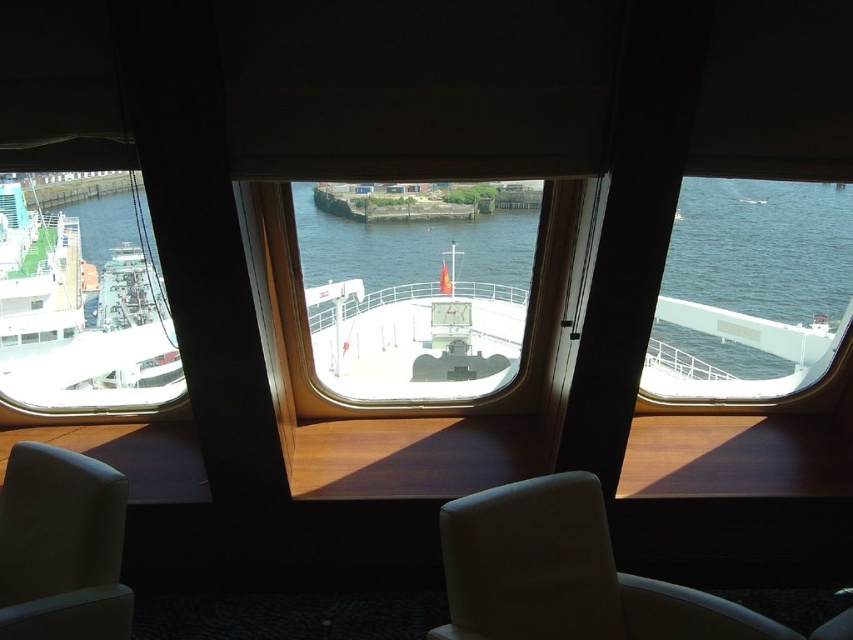
Is white leather armchair at center to the left of matte gray armchair at lower left from the viewer's perspective?

No, white leather armchair at center is not to the left of matte gray armchair at lower left.

Looking at this image, can you confirm if white leather armchair at center is thinner than matte gray armchair at lower left?

No, white leather armchair at center is not thinner than matte gray armchair at lower left.

At what (x,y) coordinates should I click in order to perform the action: click on white leather armchair at center. Please return your answer as a coordinate pair (x, y). This screenshot has width=853, height=640. Looking at the image, I should click on (572, 576).

Between point (776, 305) and point (65, 294), which one is positioned in front?

Point (776, 305) is in front.

Between point (757, 195) and point (135, 385), which one is positioned in front?

Point (757, 195) is more forward.

Image resolution: width=853 pixels, height=640 pixels. I want to click on dark blue water at right, so click(x=756, y=275).

Who is shorter, dark blue water at right or matte gray armchair at lower left?

matte gray armchair at lower left

Who is positioned more to the right, dark blue water at right or matte gray armchair at lower left?

Positioned to the right is dark blue water at right.

Where is `dark blue water at right`? dark blue water at right is located at coordinates (756, 275).

Identify the location of dark blue water at right. The image size is (853, 640). (756, 275).